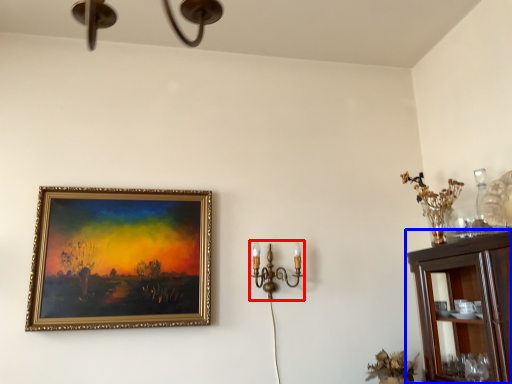
Question: Among these objects, which one is farthest to the camera, candle holder (highlighted by a red box) or cabinetry (highlighted by a blue box)?

Choices:
 (A) candle holder
 (B) cabinetry

Answer: (A)